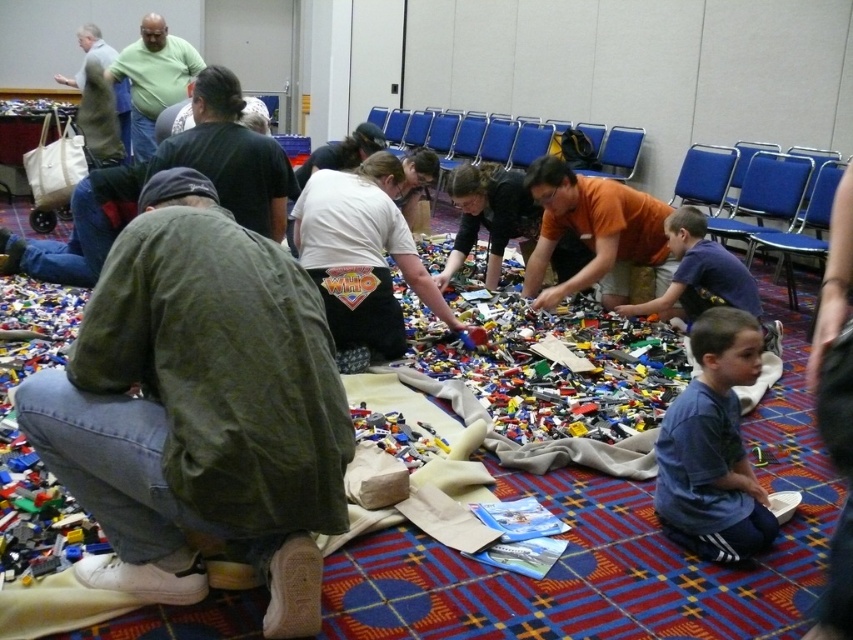
Is dark green jacket at left to the left of blue fabric chair at upper right from the viewer's perspective?

Indeed, dark green jacket at left is positioned on the left side of blue fabric chair at upper right.

Is point (49, 262) farther from camera compared to point (711, 230)?

That is False.

You are a GUI agent. You are given a task and a screenshot of the screen. Output one action in this format:
    pyautogui.click(x=<x>, y=<y>)
    Task: Click on the dark green jacket at left
    
    Given the screenshot: What is the action you would take?
    click(x=164, y=168)

Who is positioned more to the right, dark blue t-shirt at center or blue fabric chair at right?

Positioned to the right is blue fabric chair at right.

Which is in front, point (723, 259) or point (836, 275)?

Point (836, 275) is more forward.

Identify the location of dark blue t-shirt at center. This screenshot has width=853, height=640. (698, 273).

In the scene shown: Can you confirm if blue fabric chair at right is positioned above gray fabric jacket at upper left?

No, blue fabric chair at right is not above gray fabric jacket at upper left.

Does blue fabric chair at right appear on the left side of gray fabric jacket at upper left?

No, blue fabric chair at right is not to the left of gray fabric jacket at upper left.

The height and width of the screenshot is (640, 853). I want to click on blue fabric chair at right, so click(x=801, y=228).

Identify the location of blue fabric chair at right. (801, 228).